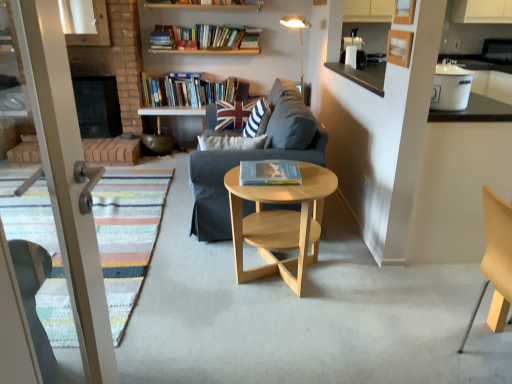
Image resolution: width=512 pixels, height=384 pixels. I want to click on vacant area to the right of natural wood coffee table at center, so click(x=358, y=282).